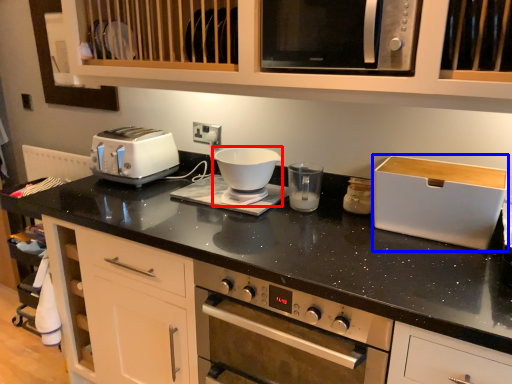
Question: Which point is further to the camera, food processor (highlighted by a red box) or appliance (highlighted by a blue box)?

Choices:
 (A) food processor
 (B) appliance

Answer: (A)